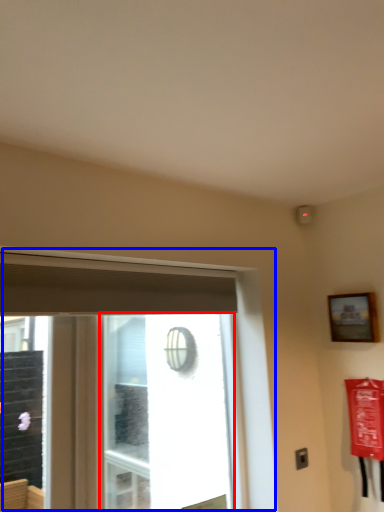
Question: Which object is closer to the camera taking this photo, window screen (highlighted by a red box) or window (highlighted by a blue box)?

Choices:
 (A) window screen
 (B) window

Answer: (B)